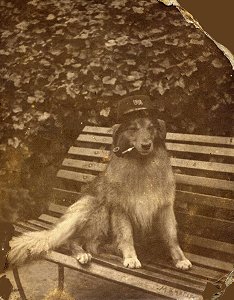
The width and height of the screenshot is (234, 300). In order to click on floor in this screenshot , I will do `click(92, 290)`.